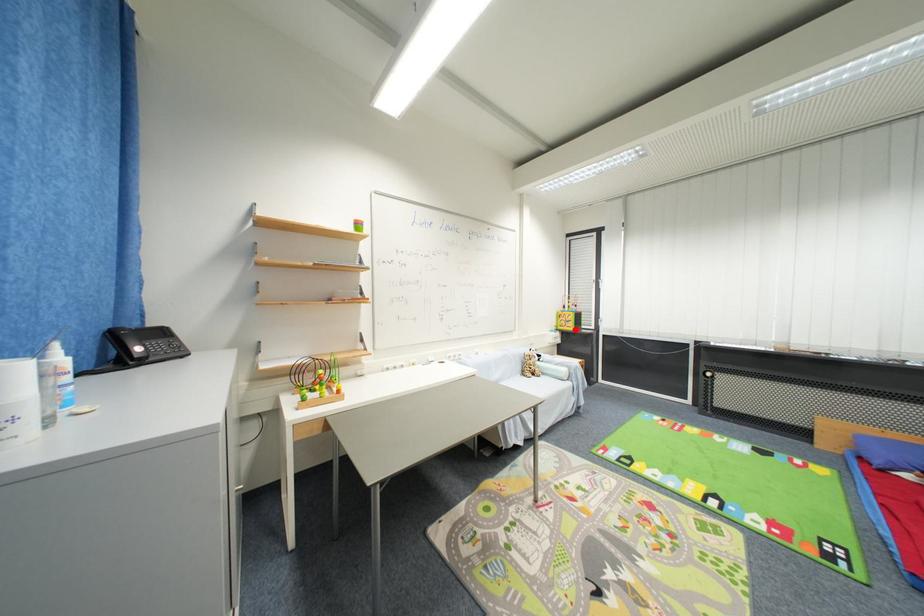
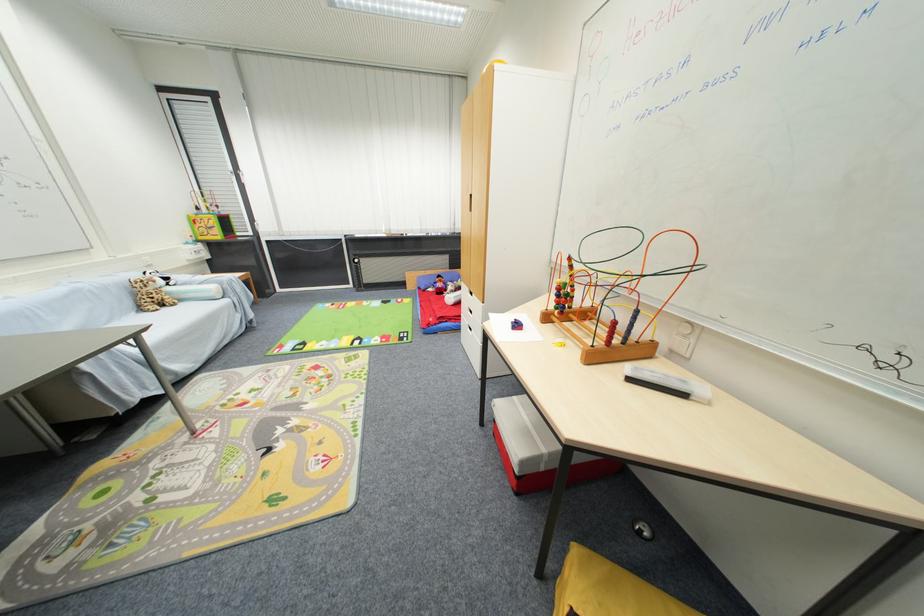
Question: I am providing you with two images of the same scene from different viewpoints. In image1, a red point is highlighted. Considering the same 3D point in image2, which of the following is correct?

Choices:
 (A) It is closer
 (B) It is farther

Answer: (A)